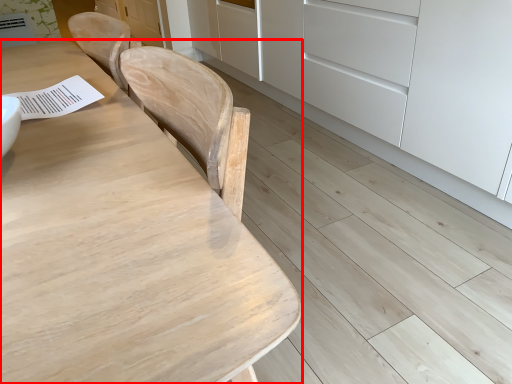
Question: From the image's perspective, considering the relative positions of table (annotated by the red box) and cabinetry in the image provided, where is table (annotated by the red box) located with respect to the staircase?

Choices:
 (A) below
 (B) above

Answer: (A)